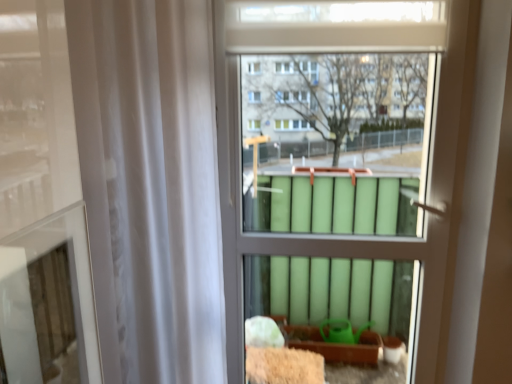
Describe the element at coordinates (338, 197) in the screenshot. The height and width of the screenshot is (384, 512). I see `green matte radiator at center` at that location.

I want to click on green matte radiator at center, so click(x=338, y=197).

This screenshot has height=384, width=512. What do you see at coordinates (150, 185) in the screenshot? I see `white sheer curtain at left` at bounding box center [150, 185].

Locate an element on the screen. The height and width of the screenshot is (384, 512). white sheer curtain at left is located at coordinates (150, 185).

Locate an element on the screen. Image resolution: width=512 pixels, height=384 pixels. green matte radiator at center is located at coordinates (338, 197).

Considering the relative positions of green matte radiator at center and white sheer curtain at left in the image provided, is green matte radiator at center to the left of white sheer curtain at left from the viewer's perspective?

No.

Is the depth of green matte radiator at center less than that of white sheer curtain at left?

No, it is not.

From the picture: Which is nearer, (249, 246) or (182, 121)?

Point (182, 121)

Consider the image. From the image's perspective, is green matte radiator at center located beneath white sheer curtain at left?

No.

From a real-world perspective, who is located lower, green matte radiator at center or white sheer curtain at left?

green matte radiator at center is physically lower.

Considering the sizes of objects green matte radiator at center and white sheer curtain at left in the image provided, who is wider, green matte radiator at center or white sheer curtain at left?

white sheer curtain at left is wider.

Who is shorter, green matte radiator at center or white sheer curtain at left?

With less height is white sheer curtain at left.

Is green matte radiator at center bigger or smaller than white sheer curtain at left?

Clearly, green matte radiator at center is smaller in size than white sheer curtain at left.

Is white sheer curtain at left inside green matte radiator at center?

Actually, white sheer curtain at left is outside green matte radiator at center.

Is green matte radiator at center next to white sheer curtain at left and touching it?

No, green matte radiator at center is not next to white sheer curtain at left.

Is green matte radiator at center turned away from white sheer curtain at left?

green matte radiator at center does not have its back to white sheer curtain at left.

How different are the orientations of green matte radiator at center and white sheer curtain at left in degrees?

The angle between the facing direction of green matte radiator at center and the facing direction of white sheer curtain at left is 1.79 degrees.

Where is `shower curtain in front of the green matte radiator at center`? shower curtain in front of the green matte radiator at center is located at coordinates (150, 185).

Looking at this image, between white sheer curtain at left and green matte radiator at center, which one appears on the left side from the viewer's perspective?

From the viewer's perspective, white sheer curtain at left appears more on the left side.

Is white sheer curtain at left in front of green matte radiator at center?

Yes, it is.

Considering the positions of points (210, 281) and (303, 246), is point (210, 281) farther from camera compared to point (303, 246)?

No, (210, 281) is in front of (303, 246).

From the image's perspective, is white sheer curtain at left located beneath green matte radiator at center?

Yes, from the image's perspective, white sheer curtain at left is below green matte radiator at center.

From a real-world perspective, is white sheer curtain at left positioned under green matte radiator at center based on gravity?

No, from a real-world perspective, white sheer curtain at left is not under green matte radiator at center.

Considering the relative sizes of white sheer curtain at left and green matte radiator at center in the image provided, is white sheer curtain at left wider than green matte radiator at center?

Indeed, white sheer curtain at left has a greater width compared to green matte radiator at center.

Considering the relative sizes of white sheer curtain at left and green matte radiator at center in the image provided, is white sheer curtain at left shorter than green matte radiator at center?

Indeed, white sheer curtain at left has a lesser height compared to green matte radiator at center.

Which of these two, white sheer curtain at left or green matte radiator at center, is smaller?

green matte radiator at center.

Is white sheer curtain at left outside of green matte radiator at center?

white sheer curtain at left lies outside green matte radiator at center's area.

Is the surface of white sheer curtain at left in direct contact with green matte radiator at center?

white sheer curtain at left is not next to green matte radiator at center, and they're not touching.

Is white sheer curtain at left oriented towards green matte radiator at center?

No, white sheer curtain at left does not turn towards green matte radiator at center.

How many degrees apart are the facing directions of white sheer curtain at left and green matte radiator at center?

white sheer curtain at left and green matte radiator at center are facing 1.79 degrees away from each other.

You are a GUI agent. You are given a task and a screenshot of the screen. Output one action in this format:
    pyautogui.click(x=<x>, y=<y>)
    Task: Click on the shower curtain that appears in front of the green matte radiator at center
    The width and height of the screenshot is (512, 384).
    Given the screenshot: What is the action you would take?
    [150, 185]

Find the location of `shower curtain that appears on the left of green matte radiator at center`. shower curtain that appears on the left of green matte radiator at center is located at coordinates (150, 185).

Locate an element on the screen. bay window that appears on the right of white sheer curtain at left is located at coordinates (338, 197).